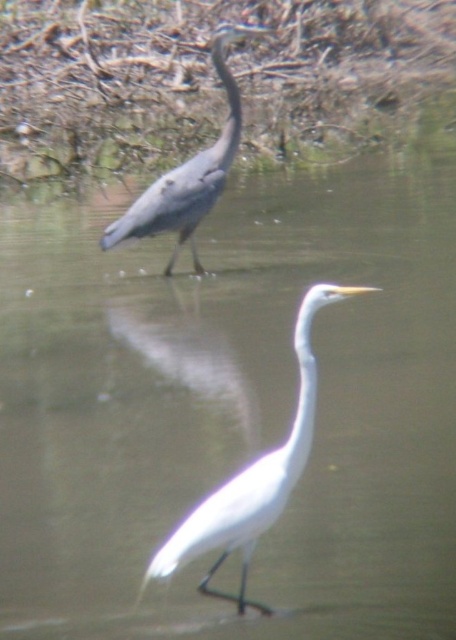
Between white smooth bird at center and gray matte heron at upper left, which one has less height?

white smooth bird at center is shorter.

Looking at this image, which is more to the left, white smooth bird at center or gray matte heron at upper left?

From the viewer's perspective, gray matte heron at upper left appears more on the left side.

Measure the distance between white smooth bird at center and camera.

white smooth bird at center and camera are 9.12 feet apart from each other.

Locate an element on the screen. This screenshot has height=640, width=456. white smooth bird at center is located at coordinates (253, 477).